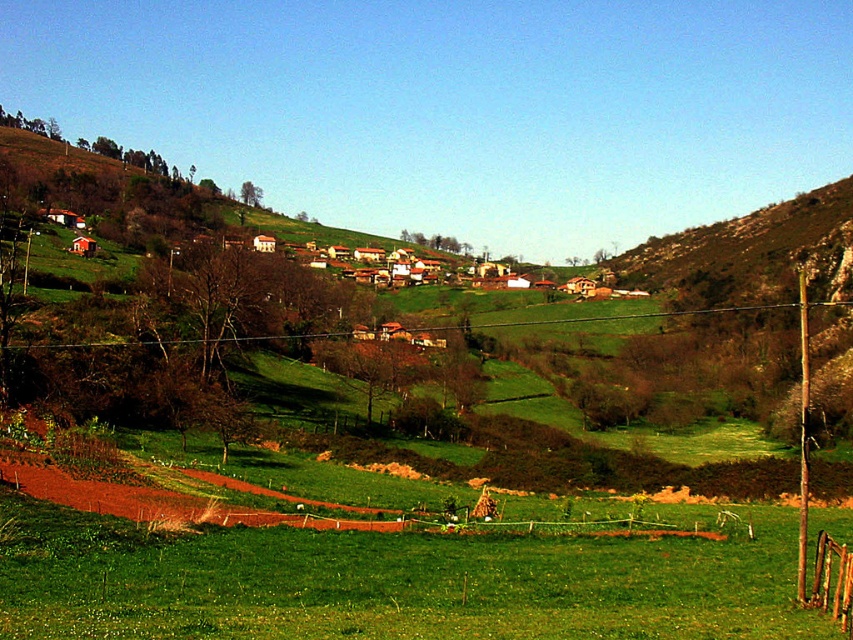
Question: Can you confirm if brown wooden fence at lower right is positioned to the right of brown furry dog at center?

Choices:
 (A) no
 (B) yes

Answer: (B)

Question: Which object appears closest to the camera in this image?

Choices:
 (A) brown furry dog at center
 (B) brown wooden fence at lower right

Answer: (B)

Question: Which of the following is the closest to the observer?

Choices:
 (A) brown furry dog at center
 (B) brown wooden fence at lower right

Answer: (B)

Question: Among these objects, which one is nearest to the camera?

Choices:
 (A) brown wooden fence at lower right
 (B) brown furry dog at center

Answer: (A)

Question: Is brown wooden fence at lower right to the left of brown furry dog at center from the viewer's perspective?

Choices:
 (A) no
 (B) yes

Answer: (A)

Question: From the image, what is the correct spatial relationship of brown wooden fence at lower right in relation to brown furry dog at center?

Choices:
 (A) below
 (B) above

Answer: (B)